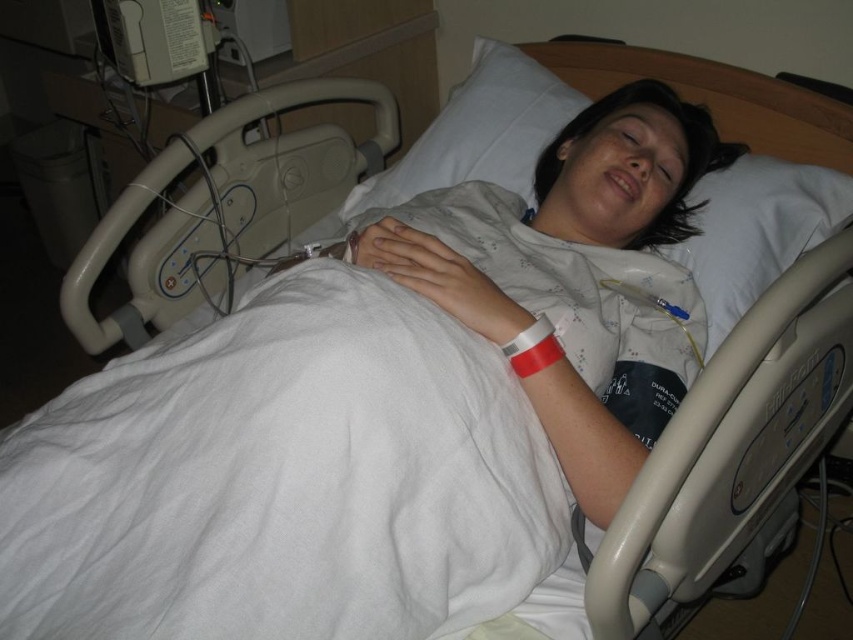
You are a nurse checking the patient in the hospital bed. You notice two points marked on the bed. The first point is at coordinates point (552,417) and the second point is at point (567,104). Which point is closer to you?

Point (552,417) is closer to the viewer than point (567,104).

You are a nurse checking on a patient in a hospital room. You need to adjust the bed so that the white fabric pillow at upper center is positioned above the red matte wristband at center. Can you do this without moving the wristband?

The white fabric pillow at upper center is bigger than the red matte wristband at center, so yes, the nurse can position the pillow above the wristband without moving it since the pillow is larger and can be placed over the wristband.